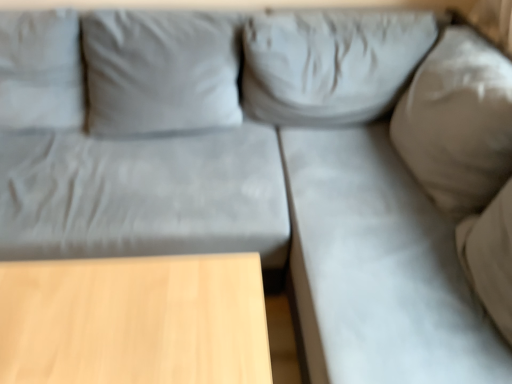
Question: Can you confirm if gray fabric couch at right is taller than light wood table at lower left?

Choices:
 (A) no
 (B) yes

Answer: (B)

Question: Considering the relative sizes of gray fabric couch at right and light wood table at lower left in the image provided, is gray fabric couch at right smaller than light wood table at lower left?

Choices:
 (A) no
 (B) yes

Answer: (A)

Question: Is gray fabric couch at right with light wood table at lower left?

Choices:
 (A) no
 (B) yes

Answer: (A)

Question: From the image's perspective, does gray fabric couch at right appear higher than light wood table at lower left?

Choices:
 (A) yes
 (B) no

Answer: (A)

Question: Is gray fabric couch at right behind light wood table at lower left?

Choices:
 (A) yes
 (B) no

Answer: (B)

Question: Considering the relative sizes of gray fabric couch at right and light wood table at lower left in the image provided, is gray fabric couch at right shorter than light wood table at lower left?

Choices:
 (A) no
 (B) yes

Answer: (A)

Question: Are light wood table at lower left and gray fabric couch at right beside each other?

Choices:
 (A) no
 (B) yes

Answer: (A)

Question: Considering the relative sizes of light wood table at lower left and gray fabric couch at right in the image provided, is light wood table at lower left taller than gray fabric couch at right?

Choices:
 (A) no
 (B) yes

Answer: (A)

Question: From the image's perspective, is light wood table at lower left on gray fabric couch at right?

Choices:
 (A) yes
 (B) no

Answer: (B)

Question: Is light wood table at lower left smaller than gray fabric couch at right?

Choices:
 (A) no
 (B) yes

Answer: (B)

Question: Does light wood table at lower left appear on the right side of gray fabric couch at right?

Choices:
 (A) no
 (B) yes

Answer: (A)

Question: From a real-world perspective, is light wood table at lower left physically above gray fabric couch at right?

Choices:
 (A) yes
 (B) no

Answer: (B)

Question: Based on their sizes in the image, would you say light wood table at lower left is bigger or smaller than gray fabric couch at right?

Choices:
 (A) small
 (B) big

Answer: (A)